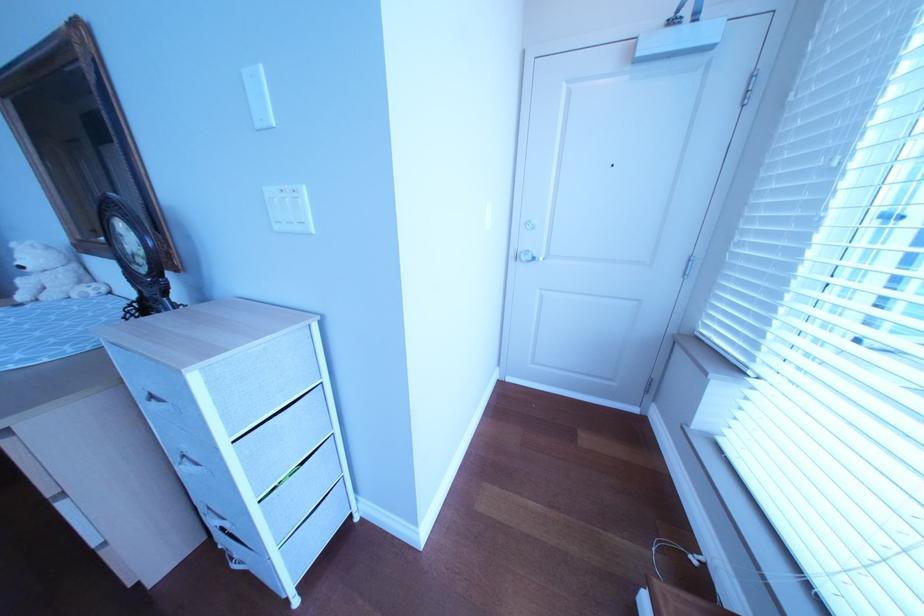
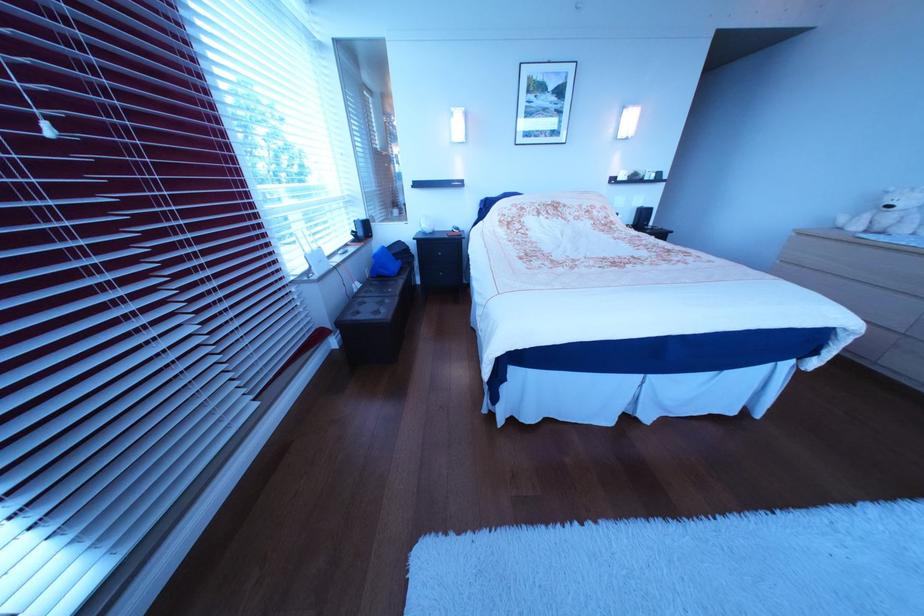
In the second image, find the point that corresponds to (37,270) in the first image.

(906, 209)